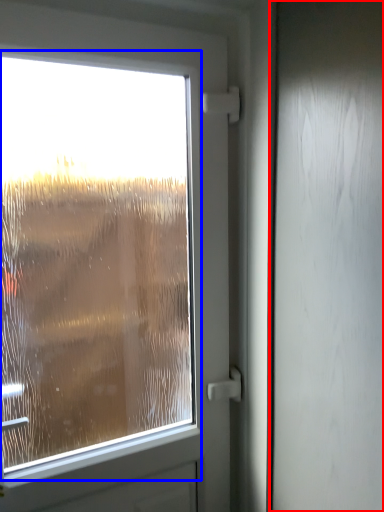
Question: Among these objects, which one is nearest to the camera, screen door (highlighted by a red box) or airplane window (highlighted by a blue box)?

Choices:
 (A) screen door
 (B) airplane window

Answer: (A)